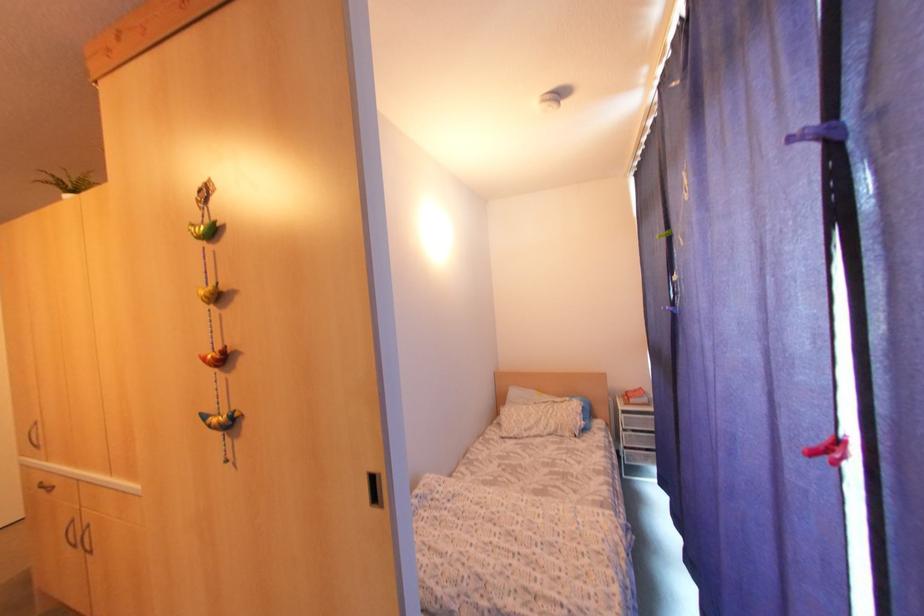
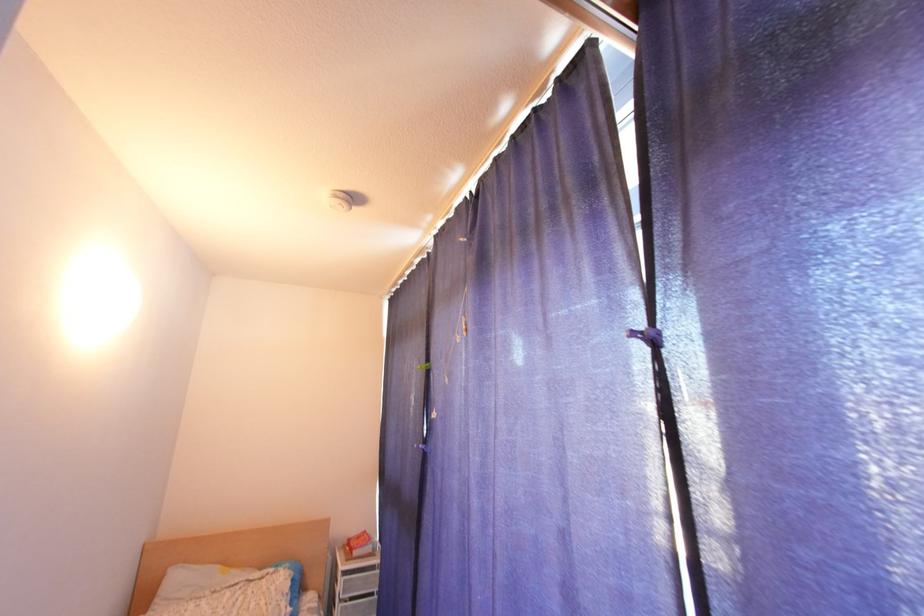
The images are taken continuously from a first-person perspective. In which direction is your viewpoint rotating?

→ The camera rotated toward right-up.